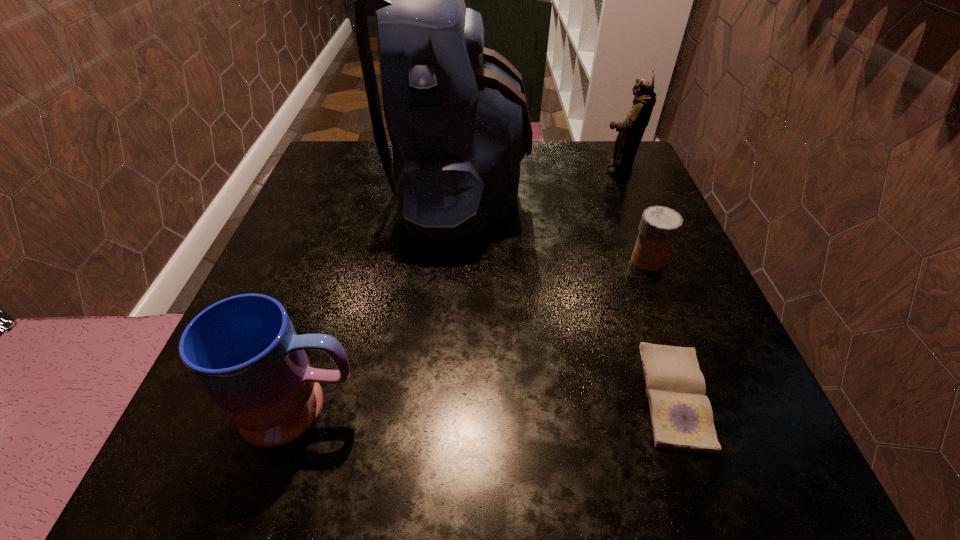
Locate an element on the screen. The height and width of the screenshot is (540, 960). medicine that is at the right edge is located at coordinates (659, 227).

Locate an element on the screen. diary that is at the right edge is located at coordinates (681, 415).

Find the location of a particular element. object positioned at the near left corner is located at coordinates (244, 351).

This screenshot has width=960, height=540. Identify the location of object at the far right corner. (631, 130).

You are a GUI agent. You are given a task and a screenshot of the screen. Output one action in this format:
    pyautogui.click(x=<x>, y=<y>)
    Task: Click on the object situated at the near right corner
    
    Given the screenshot: What is the action you would take?
    pyautogui.click(x=681, y=415)

I want to click on vacant space at the near edge, so click(x=462, y=466).

Image resolution: width=960 pixels, height=540 pixels. What are the coordinates of `free space at the left edge of the desktop` in the screenshot? It's located at (x=193, y=414).

This screenshot has height=540, width=960. In the image, there is a desktop. In order to click on vacant region at the right edge in this screenshot , I will do `click(642, 277)`.

What are the coordinates of `free location at the far left corner of the desktop` in the screenshot? It's located at (354, 161).

At what (x,y) coordinates should I click in order to perform the action: click on vacant space at the near left corner of the desktop. Please return your answer as a coordinate pair (x, y). The height and width of the screenshot is (540, 960). Looking at the image, I should click on (213, 448).